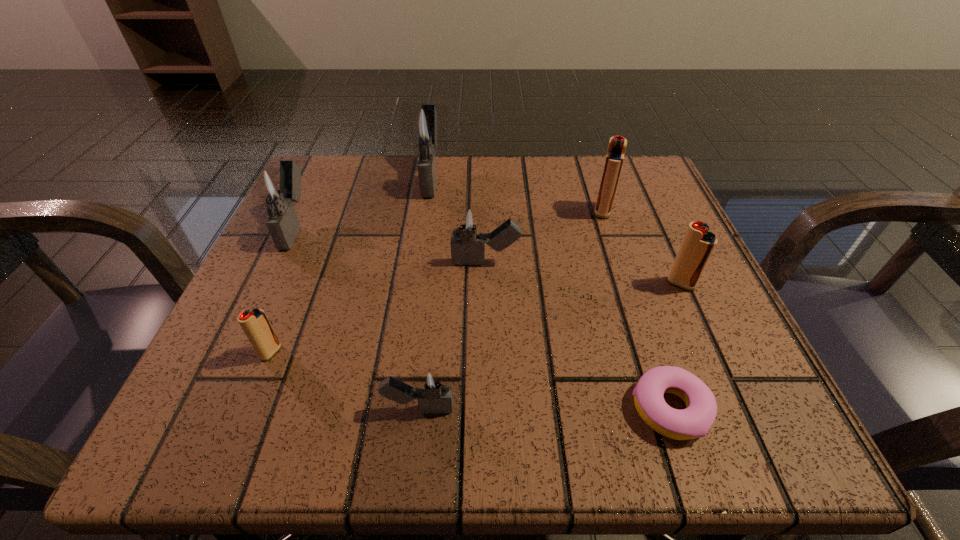
At what (x,y) coordinates should I click in order to perform the action: click on free space located 0.160m on the back of the nearest igniter. Please return your answer as a coordinate pair (x, y). The width and height of the screenshot is (960, 540). Looking at the image, I should click on (430, 301).

This screenshot has width=960, height=540. Identify the location of free location located on the back of the shortest object. (610, 228).

Find the location of a particular element. This screenshot has height=540, width=960. igniter that is at the near edge is located at coordinates pos(433,391).

Identify the location of doughnut that is at the near edge. (695, 421).

Where is `doughnut present at the right edge`? Image resolution: width=960 pixels, height=540 pixels. doughnut present at the right edge is located at coordinates (695, 421).

Identify the location of object present at the far left corner. (277, 188).

Where is `object present at the far right corner`? The height and width of the screenshot is (540, 960). object present at the far right corner is located at coordinates (617, 145).

Where is `object that is at the near right corner`? The image size is (960, 540). object that is at the near right corner is located at coordinates (695, 421).

You are a GUI agent. You are given a task and a screenshot of the screen. Output one action in this format:
    pyautogui.click(x=<x>, y=<y>)
    Task: Click on the blank area at the far edge
    The image size is (960, 540).
    Given the screenshot: What is the action you would take?
    pyautogui.click(x=455, y=188)

Find the location of a particular element. vacant space at the near edge of the desktop is located at coordinates (387, 444).